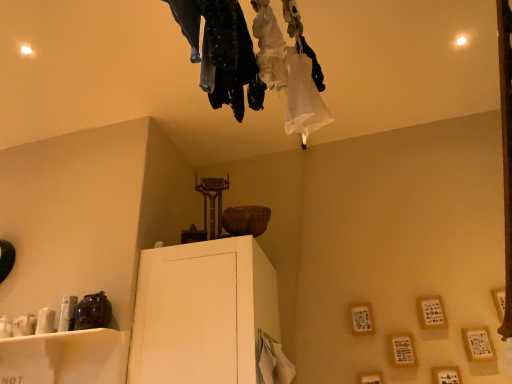
The image size is (512, 384). What do you see at coordinates (65, 357) in the screenshot?
I see `white glossy shelf at lower left, the 1th furniture in the left-to-right sequence` at bounding box center [65, 357].

Image resolution: width=512 pixels, height=384 pixels. What do you see at coordinates (222, 52) in the screenshot?
I see `dark textured pants at upper center` at bounding box center [222, 52].

What is the approximate width of white matte cabinet at center, the first furniture viewed from the right?

white matte cabinet at center, the first furniture viewed from the right, is 32.33 inches wide.

Where is `white glossy shelf at lower left, which is the 2th furniture in right-to-left order`? This screenshot has width=512, height=384. white glossy shelf at lower left, which is the 2th furniture in right-to-left order is located at coordinates (65, 357).

From the image's perspective, which one is positioned higher, white glossy shelf at lower left, which is the 2th furniture in right-to-left order, or white matte cabinet at center, the first furniture viewed from the right?

From the image's view, white matte cabinet at center, the first furniture viewed from the right, is above.

Consider the image. Between white glossy shelf at lower left, which is the 2th furniture in right-to-left order, and white matte cabinet at center, which appears as the second furniture when viewed from the left, which one has larger size?

With larger size is white matte cabinet at center, which appears as the second furniture when viewed from the left.

What's the angular difference between white glossy shelf at lower left, the 1th furniture in the left-to-right sequence, and white matte cabinet at center, the first furniture viewed from the right,'s facing directions?

They differ by 0.774 degrees in their facing directions.

Between white glossy shelf at lower left, which is the 2th furniture in right-to-left order, and white matte cabinet at center, which appears as the second furniture when viewed from the left, which one has larger width?

Wider between the two is white matte cabinet at center, which appears as the second furniture when viewed from the left.

Is white glossy shelf at lower left, which is the 2th furniture in right-to-left order, at the back of dark textured pants at upper center?

No, dark textured pants at upper center's orientation is not away from white glossy shelf at lower left, which is the 2th furniture in right-to-left order.

From the image's perspective, which one is positioned higher, dark textured pants at upper center or white glossy shelf at lower left, which is the 2th furniture in right-to-left order?

dark textured pants at upper center.

What's the angular difference between dark textured pants at upper center and white glossy shelf at lower left, which is the 2th furniture in right-to-left order,'s facing directions?

89.9 degrees.

Which of these two, dark textured pants at upper center or white glossy shelf at lower left, the 1th furniture in the left-to-right sequence, is smaller?

With smaller size is dark textured pants at upper center.

Would you say white matte cabinet at center, the first furniture viewed from the right, is inside or outside dark textured pants at upper center?

white matte cabinet at center, the first furniture viewed from the right, is not enclosed by dark textured pants at upper center.

From the image's perspective, is white matte cabinet at center, which appears as the second furniture when viewed from the left, located above or below dark textured pants at upper center?

white matte cabinet at center, which appears as the second furniture when viewed from the left, is below dark textured pants at upper center.

Between white matte cabinet at center, the first furniture viewed from the right, and dark textured pants at upper center, which one has larger width?

white matte cabinet at center, the first furniture viewed from the right.

In terms of height, does white matte cabinet at center, the first furniture viewed from the right, look taller or shorter compared to white glossy shelf at lower left, which is the 2th furniture in right-to-left order?

In the image, white matte cabinet at center, the first furniture viewed from the right, appears to be taller than white glossy shelf at lower left, which is the 2th furniture in right-to-left order.

Is white glossy shelf at lower left, which is the 2th furniture in right-to-left order, completely or partially inside white matte cabinet at center, the first furniture viewed from the right?

No, white glossy shelf at lower left, which is the 2th furniture in right-to-left order, is not surrounded by white matte cabinet at center, the first furniture viewed from the right.

Based on the photo, from a real-world perspective, does white matte cabinet at center, which appears as the second furniture when viewed from the left, sit lower than white glossy shelf at lower left, the 1th furniture in the left-to-right sequence?

No, from a real-world perspective, white matte cabinet at center, which appears as the second furniture when viewed from the left, is not under white glossy shelf at lower left, the 1th furniture in the left-to-right sequence.

Does point (221, 252) appear closer or farther from the camera than point (35, 341)?

Point (221, 252) is positioned farther from the camera compared to point (35, 341).

From the image's perspective, which one is positioned lower, dark textured pants at upper center or white matte cabinet at center, which appears as the second furniture when viewed from the left?

white matte cabinet at center, which appears as the second furniture when viewed from the left, from the image's perspective.

Which of these two, dark textured pants at upper center or white matte cabinet at center, which appears as the second furniture when viewed from the left, is wider?

white matte cabinet at center, which appears as the second furniture when viewed from the left.

Considering the points (257, 80) and (264, 314), which point is in front, point (257, 80) or point (264, 314)?

Positioned in front is point (257, 80).

Considering the sizes of objects dark textured pants at upper center and white matte cabinet at center, the first furniture viewed from the right, in the image provided, who is bigger, dark textured pants at upper center or white matte cabinet at center, the first furniture viewed from the right,?

white matte cabinet at center, the first furniture viewed from the right.

Which is more to the left, white glossy shelf at lower left, which is the 2th furniture in right-to-left order, or dark textured pants at upper center?

From the viewer's perspective, white glossy shelf at lower left, which is the 2th furniture in right-to-left order, appears more on the left side.

Who is more distant, white glossy shelf at lower left, the 1th furniture in the left-to-right sequence, or dark textured pants at upper center?

white glossy shelf at lower left, the 1th furniture in the left-to-right sequence.

From the image's perspective, which is above, white glossy shelf at lower left, which is the 2th furniture in right-to-left order, or dark textured pants at upper center?

From the image's view, dark textured pants at upper center is above.

Is dark textured pants at upper center surrounded by white glossy shelf at lower left, the 1th furniture in the left-to-right sequence?

No, white glossy shelf at lower left, the 1th furniture in the left-to-right sequence, does not contain dark textured pants at upper center.

The image size is (512, 384). Find the location of `furniture that appears in front of the white matte cabinet at center, the first furniture viewed from the right`. furniture that appears in front of the white matte cabinet at center, the first furniture viewed from the right is located at coordinates (65, 357).

From the image's perspective, which furniture is the 2nd one below the dark textured pants at upper center? Please provide its 2D coordinates.

[(65, 357)]

Which object lies further to the anchor point dark textured pants at upper center, white glossy shelf at lower left, the 1th furniture in the left-to-right sequence, or white matte cabinet at center, which appears as the second furniture when viewed from the left?

white glossy shelf at lower left, the 1th furniture in the left-to-right sequence, lies further to dark textured pants at upper center than the other object.

From the image, which object appears to be farther from white matte cabinet at center, which appears as the second furniture when viewed from the left, dark textured pants at upper center or white glossy shelf at lower left, the 1th furniture in the left-to-right sequence?

dark textured pants at upper center is further to white matte cabinet at center, which appears as the second furniture when viewed from the left.

When comparing their distances from white glossy shelf at lower left, the 1th furniture in the left-to-right sequence, does white matte cabinet at center, which appears as the second furniture when viewed from the left, or dark textured pants at upper center seem closer?

white matte cabinet at center, which appears as the second furniture when viewed from the left.

Which object lies further to the anchor point dark textured pants at upper center, white matte cabinet at center, which appears as the second furniture when viewed from the left, or white glossy shelf at lower left, which is the 2th furniture in right-to-left order?

white glossy shelf at lower left, which is the 2th furniture in right-to-left order, is further to dark textured pants at upper center.

Which object lies further to the anchor point white matte cabinet at center, the first furniture viewed from the right, white glossy shelf at lower left, which is the 2th furniture in right-to-left order, or dark textured pants at upper center?

dark textured pants at upper center.

Considering their positions, is dark textured pants at upper center positioned closer to white glossy shelf at lower left, which is the 2th furniture in right-to-left order, than white matte cabinet at center, which appears as the second furniture when viewed from the left?

white matte cabinet at center, which appears as the second furniture when viewed from the left, lies closer to white glossy shelf at lower left, which is the 2th furniture in right-to-left order, than the other object.

Locate an element on the screen. The width and height of the screenshot is (512, 384). furniture between dark textured pants at upper center and white glossy shelf at lower left, the 1th furniture in the left-to-right sequence, vertically is located at coordinates [202, 312].